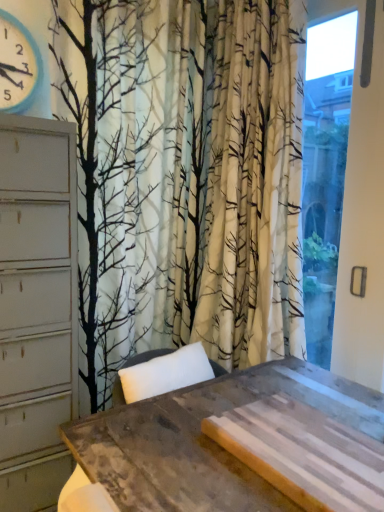
Question: From a real-world perspective, is rustic wood table at center physically below blue plastic clock at upper left?

Choices:
 (A) no
 (B) yes

Answer: (B)

Question: Is rustic wood table at center oriented away from blue plastic clock at upper left?

Choices:
 (A) no
 (B) yes

Answer: (A)

Question: From the image's perspective, is rustic wood table at center below blue plastic clock at upper left?

Choices:
 (A) no
 (B) yes

Answer: (B)

Question: Can you confirm if rustic wood table at center is wider than blue plastic clock at upper left?

Choices:
 (A) yes
 (B) no

Answer: (A)

Question: Could you tell me if rustic wood table at center is facing blue plastic clock at upper left?

Choices:
 (A) yes
 (B) no

Answer: (B)

Question: Is rustic wood table at center next to blue plastic clock at upper left and touching it?

Choices:
 (A) no
 (B) yes

Answer: (A)

Question: Is transparent glass window at right beside blue plastic clock at upper left?

Choices:
 (A) yes
 (B) no

Answer: (B)

Question: Is transparent glass window at right not within blue plastic clock at upper left?

Choices:
 (A) yes
 (B) no

Answer: (A)

Question: Considering the relative positions of transparent glass window at right and blue plastic clock at upper left in the image provided, is transparent glass window at right in front of blue plastic clock at upper left?

Choices:
 (A) no
 (B) yes

Answer: (B)

Question: From the image's perspective, is transparent glass window at right below blue plastic clock at upper left?

Choices:
 (A) no
 (B) yes

Answer: (B)

Question: Can you confirm if transparent glass window at right is positioned to the left of blue plastic clock at upper left?

Choices:
 (A) yes
 (B) no

Answer: (B)

Question: Considering the relative sizes of transparent glass window at right and blue plastic clock at upper left in the image provided, is transparent glass window at right taller than blue plastic clock at upper left?

Choices:
 (A) yes
 (B) no

Answer: (A)

Question: From the image's perspective, would you say blue plastic clock at upper left is positioned over rustic wood table at center?

Choices:
 (A) yes
 (B) no

Answer: (A)